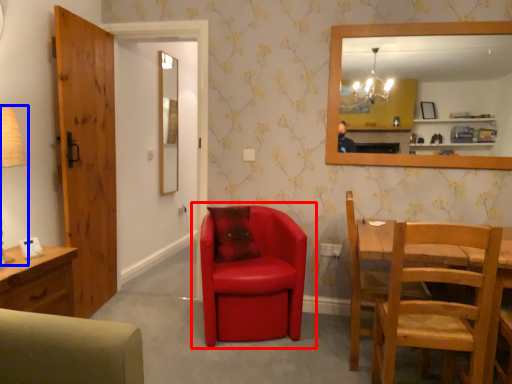
Question: Which of the following is the farthest to the observer, chair (highlighted by a red box) or table lamp (highlighted by a blue box)?

Choices:
 (A) chair
 (B) table lamp

Answer: (A)